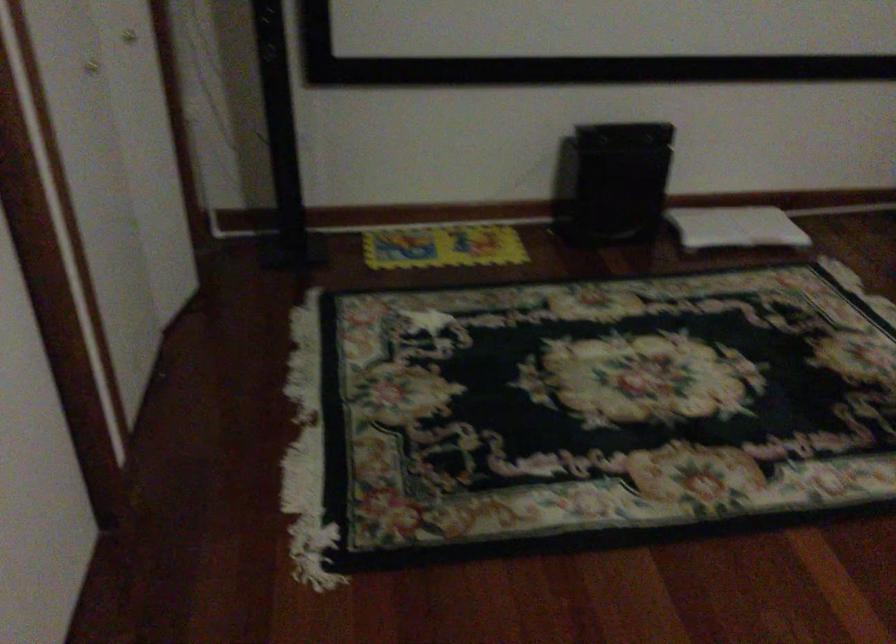
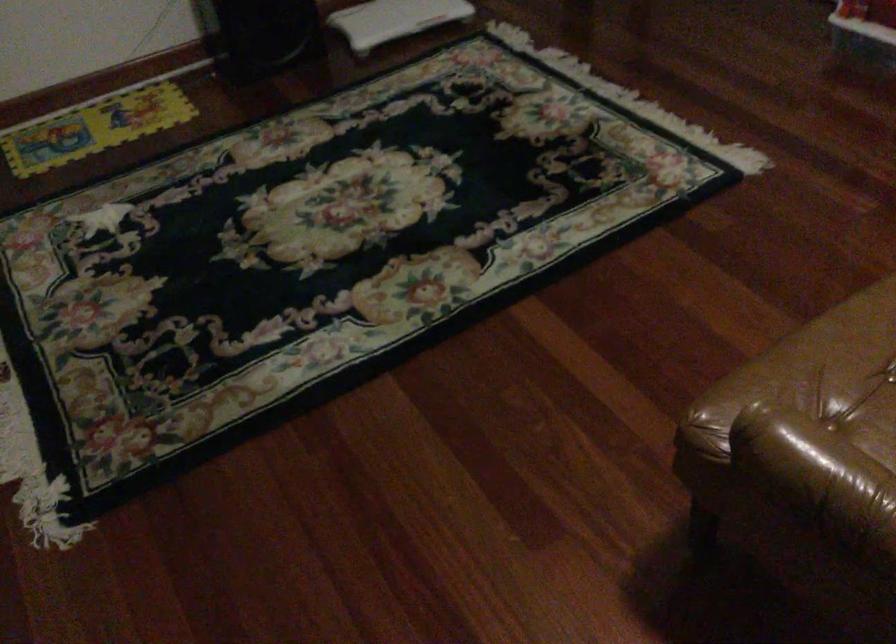
Which direction would the cameraman need to move to produce the second image?

The movement direction of the cameraman is right, forward.